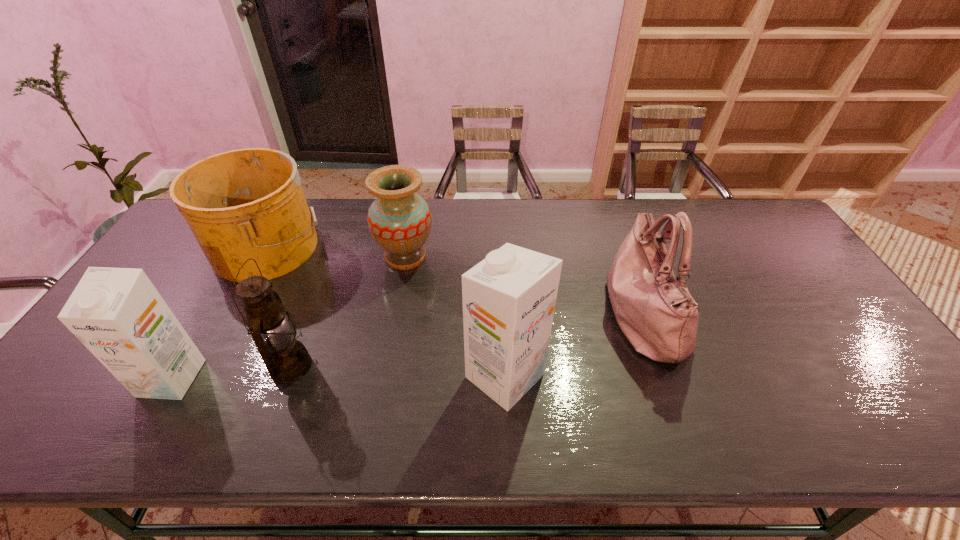
You are a GUI agent. You are given a task and a screenshot of the screen. Output one action in this format:
    pyautogui.click(x=<x>, y=<y>)
    Task: Click on the empty space that is in between the left carton and the second object from right to left
    The height and width of the screenshot is (540, 960).
    Given the screenshot: What is the action you would take?
    pyautogui.click(x=338, y=377)

At what (x,y) coordinates should I click in order to perform the action: click on empty space between the shorter carton and the oil lamp. Please return your answer as a coordinate pair (x, y). The image size is (960, 540). Looking at the image, I should click on (231, 372).

Image resolution: width=960 pixels, height=540 pixels. What are the coordinates of `vacant space that is in between the bucket and the fourth object from left to right` in the screenshot? It's located at (337, 252).

Identify the location of the third closest object to the shorter carton. This screenshot has width=960, height=540. (399, 220).

The width and height of the screenshot is (960, 540). Find the location of `object that can be found as the fourth closest to the shorter carton`. object that can be found as the fourth closest to the shorter carton is located at coordinates (509, 298).

Image resolution: width=960 pixels, height=540 pixels. I want to click on free space in the image that satisfies the following two spatial constraints: 1. on the back side of the vase; 2. on the left side of the left carton, so click(243, 256).